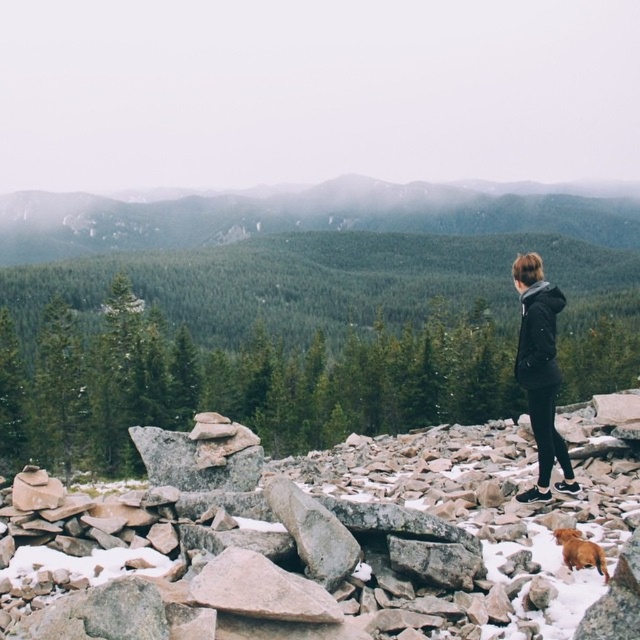
Question: Is black matte jacket at center positioned at the back of brown furry dog at lower right?

Choices:
 (A) no
 (B) yes

Answer: (B)

Question: Which point is farther to the camera?

Choices:
 (A) (604, 554)
 (B) (570, 472)
 (C) (72, 625)

Answer: (B)

Question: Considering the real-world distances, which object is farthest from the smooth gray rock at center?

Choices:
 (A) black matte jacket at center
 (B) brown furry dog at lower right

Answer: (B)

Question: Can you confirm if smooth gray rock at center is positioned below brown furry dog at lower right?

Choices:
 (A) yes
 (B) no

Answer: (A)

Question: Among these points, which one is nearest to the camera?

Choices:
 (A) (529, 419)
 (B) (554, 628)
 (C) (595, 547)

Answer: (B)

Question: Does smooth gray rock at center have a larger size compared to black matte jacket at center?

Choices:
 (A) no
 (B) yes

Answer: (A)